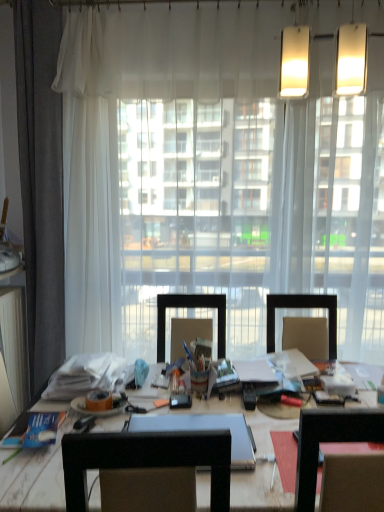
Question: Can you confirm if orange matte adhesive tape at center is bigger than wooden desk at center?

Choices:
 (A) no
 (B) yes

Answer: (A)

Question: Is orange matte adhesive tape at center facing towards wooden desk at center?

Choices:
 (A) no
 (B) yes

Answer: (A)

Question: Is orange matte adhesive tape at center beside wooden desk at center?

Choices:
 (A) yes
 (B) no

Answer: (B)

Question: Is orange matte adhesive tape at center to the right of wooden desk at center from the viewer's perspective?

Choices:
 (A) no
 (B) yes

Answer: (A)

Question: Is the depth of orange matte adhesive tape at center less than that of wooden desk at center?

Choices:
 (A) yes
 (B) no

Answer: (B)

Question: Is wooden desk at center at the back of orange matte adhesive tape at center?

Choices:
 (A) yes
 (B) no

Answer: (B)

Question: Considering the relative sizes of orange matte adhesive tape at center and blue paper book at lower left in the image provided, is orange matte adhesive tape at center taller than blue paper book at lower left?

Choices:
 (A) yes
 (B) no

Answer: (A)

Question: Does orange matte adhesive tape at center have a smaller size compared to blue paper book at lower left?

Choices:
 (A) yes
 (B) no

Answer: (B)

Question: Is orange matte adhesive tape at center shorter than blue paper book at lower left?

Choices:
 (A) no
 (B) yes

Answer: (A)

Question: From a real-world perspective, is orange matte adhesive tape at center beneath blue paper book at lower left?

Choices:
 (A) no
 (B) yes

Answer: (A)

Question: From a real-world perspective, is orange matte adhesive tape at center on blue paper book at lower left?

Choices:
 (A) no
 (B) yes

Answer: (B)

Question: Is there a large distance between orange matte adhesive tape at center and blue paper book at lower left?

Choices:
 (A) no
 (B) yes

Answer: (A)

Question: From the image's perspective, is blue paper book at lower left over orange matte adhesive tape at center?

Choices:
 (A) yes
 (B) no

Answer: (B)